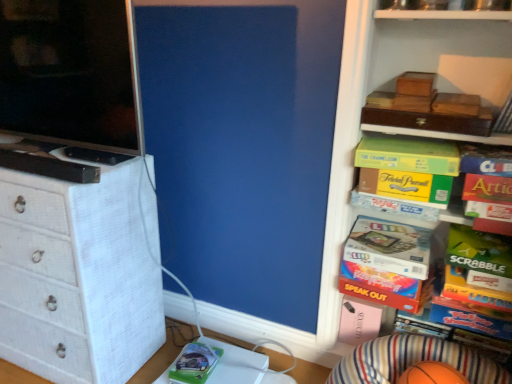
What do you see at coordinates (242, 366) in the screenshot? I see `white glossy computer desk at lower center` at bounding box center [242, 366].

Where is `green cardboard box at upper right, the 2th storage box in the top-to-bottom sequence`? Image resolution: width=512 pixels, height=384 pixels. green cardboard box at upper right, the 2th storage box in the top-to-bottom sequence is located at coordinates (407, 186).

Describe the element at coordinates (456, 104) in the screenshot. I see `wooden box at upper right, positioned as the 2th storage box in bottom-to-top order` at that location.

The height and width of the screenshot is (384, 512). What do you see at coordinates (394, 206) in the screenshot?
I see `yellow cardboard board game at upper right, the 2th book when ordered from bottom to top` at bounding box center [394, 206].

The height and width of the screenshot is (384, 512). Describe the element at coordinates (359, 321) in the screenshot. I see `pink matte box at lower right, which appears as the second box when viewed from the front` at that location.

This screenshot has width=512, height=384. In order to click on white glossy computer desk at lower center in this screenshot , I will do `click(242, 366)`.

Considering the relative sizes of green matte comic book at lower center and wooden boxes at upper right in the image provided, is green matte comic book at lower center wider than wooden boxes at upper right?

No.

Is the surface of green matte comic book at lower center in direct contact with wooden boxes at upper right?

There is a gap between green matte comic book at lower center and wooden boxes at upper right.

Measure the distance between green matte comic book at lower center and wooden boxes at upper right.

green matte comic book at lower center and wooden boxes at upper right are 82.86 centimeters apart.

Does point (219, 352) come closer to viewer compared to point (480, 34)?

No.

Based on the photo, does green cardboard game at upper right, the fourth book positioned from the bottom, have a lesser height compared to green matte scrabble board game at right, arranged as the second box when viewed from the back?

Yes, green cardboard game at upper right, the fourth book positioned from the bottom, is shorter than green matte scrabble board game at right, arranged as the second box when viewed from the back.

Where is `book that is the 2nd object located behind the green matte scrabble board game at right, which ranks as the first box in right-to-left order`? This screenshot has height=384, width=512. book that is the 2nd object located behind the green matte scrabble board game at right, which ranks as the first box in right-to-left order is located at coordinates (408, 155).

Is green cardboard game at upper right, the fourth book positioned from the bottom, next to green matte scrabble board game at right, which is the second box in bottom-to-top order?

green cardboard game at upper right, the fourth book positioned from the bottom, and green matte scrabble board game at right, which is the second box in bottom-to-top order, are not in contact.

From a real-world perspective, is green cardboard game at upper right, the fourth book positioned from the bottom, physically located above or below green matte scrabble board game at right, which ranks as the first box in right-to-left order?

green cardboard game at upper right, the fourth book positioned from the bottom, is above green matte scrabble board game at right, which ranks as the first box in right-to-left order.

From the image's perspective, which object appears higher, white woven chest of drawers at left or pink matte box at lower right, which appears as the first box when ordered from the bottom?

white woven chest of drawers at left appears higher in the image.

Which of these two, white woven chest of drawers at left or pink matte box at lower right, the first box in the back-to-front sequence, is thinner?

pink matte box at lower right, the first box in the back-to-front sequence, is thinner.

In the scene shown: Considering the relative sizes of white woven chest of drawers at left and pink matte box at lower right, which is the second box from right to left, in the image provided, is white woven chest of drawers at left bigger than pink matte box at lower right, which is the second box from right to left,?

Yes, white woven chest of drawers at left is bigger than pink matte box at lower right, which is the second box from right to left.

Consider the image. Which object is closer to the camera, white woven chest of drawers at left or pink matte box at lower right, which appears as the second box when viewed from the front?

white woven chest of drawers at left is closer to the camera.

Does point (433, 186) lie in front of point (393, 242)?

Yes, it is in front of point (393, 242).

From a real-world perspective, is green cardboard box at upper right, the 2th storage box in the top-to-bottom sequence, physically below multicolored cardboard game at center right, which is counted as the 1th book, starting from the bottom?

No.

Is green cardboard box at upper right, the 2th storage box in the top-to-bottom sequence, surrounding multicolored cardboard game at center right, which is counted as the 1th book, starting from the bottom?

No, multicolored cardboard game at center right, which is counted as the 1th book, starting from the bottom, is not surrounded by green cardboard box at upper right, the 2th storage box in the top-to-bottom sequence.

Visually, is green cardboard box at upper right, placed as the first storage box when sorted from bottom to top, positioned to the left or to the right of multicolored cardboard game at center right, which is counted as the 1th book, starting from the bottom?

From the image, it's evident that green cardboard box at upper right, placed as the first storage box when sorted from bottom to top, is to the right of multicolored cardboard game at center right, which is counted as the 1th book, starting from the bottom.

Which is correct: white glossy computer desk at lower center is inside orange rubber basketball at lower right, or outside of it?

white glossy computer desk at lower center is located beyond the bounds of orange rubber basketball at lower right.

From the image's perspective, which object appears higher, white glossy computer desk at lower center or orange rubber basketball at lower right?

white glossy computer desk at lower center appears higher in the image.

Considering the relative sizes of white glossy computer desk at lower center and orange rubber basketball at lower right in the image provided, is white glossy computer desk at lower center shorter than orange rubber basketball at lower right?

Indeed, white glossy computer desk at lower center has a lesser height compared to orange rubber basketball at lower right.

From the picture: Can you confirm if green matte scrabble board game at right, arranged as the second box when viewed from the back, is thinner than green matte comic book at lower center?

Incorrect, the width of green matte scrabble board game at right, arranged as the second box when viewed from the back, is not less than that of green matte comic book at lower center.

Which is more to the left, green matte scrabble board game at right, acting as the 2th box starting from the left, or green matte comic book at lower center?

green matte comic book at lower center.

In the scene shown: Can you confirm if green matte scrabble board game at right, acting as the 2th box starting from the left, is shorter than green matte comic book at lower center?

Incorrect, the height of green matte scrabble board game at right, acting as the 2th box starting from the left, does not fall short of that of green matte comic book at lower center.

Is point (457, 262) closer or farther from the camera than point (198, 343)?

Clearly, point (457, 262) is closer to the camera than point (198, 343).

Could you measure the distance between wooden box at upper right, positioned as the 2th storage box in bottom-to-top order, and green matte comic book at lower center?

The distance of wooden box at upper right, positioned as the 2th storage box in bottom-to-top order, from green matte comic book at lower center is 1.21 meters.

From the image's perspective, does wooden box at upper right, positioned as the 2th storage box in bottom-to-top order, appear higher than green matte comic book at lower center?

Yes.

Which is behind, wooden box at upper right, the 1th storage box when ordered from top to bottom, or green matte comic book at lower center?

green matte comic book at lower center is more distant.

From a real-world perspective, is wooden box at upper right, the 1th storage box when ordered from top to bottom, beneath green matte comic book at lower center?

No, from a real-world perspective, wooden box at upper right, the 1th storage box when ordered from top to bottom, is not under green matte comic book at lower center.

Locate an element on the screen. This screenshot has height=384, width=512. comic book below the wooden boxes at upper right (from a real-world perspective) is located at coordinates (194, 364).

Locate an element on the screen. box that appears on the right of green cardboard game at upper right, placed as the second book when sorted from top to bottom is located at coordinates (479, 251).

From the image, which object appears to be nearer to articulated paperboard game at right, which appears as the 3th book when viewed from the top, wooden boxes at upper right or orange rubber basketball at lower right?

wooden boxes at upper right is positioned closer to the anchor articulated paperboard game at right, which appears as the 3th book when viewed from the top.

When comparing their distances from orange rubber basketball at lower right, does green matte comic book at lower center or green matte scrabble board game at right, arranged as the first box when viewed from the front, seem further?

green matte comic book at lower center is positioned further to the anchor orange rubber basketball at lower right.

Estimate the real-world distances between objects in this image. Which object is further from wooden boxes at upper right, white woven chest of drawers at left or articulated paperboard game at right, which appears as the 3th book when viewed from the top?

Among the two, white woven chest of drawers at left is located further to wooden boxes at upper right.

Considering their positions, is articulated paperboard game at right, which appears as the 3th book when viewed from the top, positioned closer to green cardboard book at upper right, acting as the 5th book starting from the bottom, than green matte comic book at lower center?

articulated paperboard game at right, which appears as the 3th book when viewed from the top.

Considering their positions, is yellow cardboard board game at upper right, the 2th book when ordered from bottom to top, positioned further to wooden box at upper right, the 1th storage box when ordered from top to bottom, than orange rubber basketball at lower right?

Among the two, orange rubber basketball at lower right is located further to wooden box at upper right, the 1th storage box when ordered from top to bottom.

Which object lies nearer to the anchor point pink matte box at lower right, which appears as the second box when viewed from the front, orange rubber basketball at lower right or wooden boxes at upper right?

Based on the image, orange rubber basketball at lower right appears to be nearer to pink matte box at lower right, which appears as the second box when viewed from the front.

When comparing their distances from wooden boxes at upper right, does wooden box at upper right, the 1th storage box when ordered from top to bottom, or multicolored cardboard game at center right, which is counted as the fifth book, starting from the top, seem further?

wooden box at upper right, the 1th storage box when ordered from top to bottom, lies further to wooden boxes at upper right than the other object.

Based on their spatial positions, is matte black screen at left or yellow cardboard board game at upper right, the 2th book when ordered from bottom to top, closer to wooden boxes at upper right?

yellow cardboard board game at upper right, the 2th book when ordered from bottom to top, is closer to wooden boxes at upper right.

You are a GUI agent. You are given a task and a screenshot of the screen. Output one action in this format:
    pyautogui.click(x=<x>, y=<y>)
    Task: Click on the computer desk between white woven chest of drawers at left and pink matte box at lower right, which appears as the second box when viewed from the front, from left to right
    The height and width of the screenshot is (384, 512).
    Given the screenshot: What is the action you would take?
    pyautogui.click(x=242, y=366)

In order to click on comic book between green cardboard box at upper right, placed as the first storage box when sorted from bottom to top, and white glossy computer desk at lower center from top to bottom in this screenshot , I will do `click(194, 364)`.

Locate an element on the screen. This screenshot has height=384, width=512. box between wooden boxes at upper right and yellow cardboard board game at upper right, the 2th book when ordered from bottom to top, in the front-back direction is located at coordinates (479, 251).

Locate an element on the screen. shelf located between white woven chest of drawers at left and articulated paperboard game at right, marked as the 3th book in a bottom-to-top arrangement, in the left-right direction is located at coordinates (391, 90).